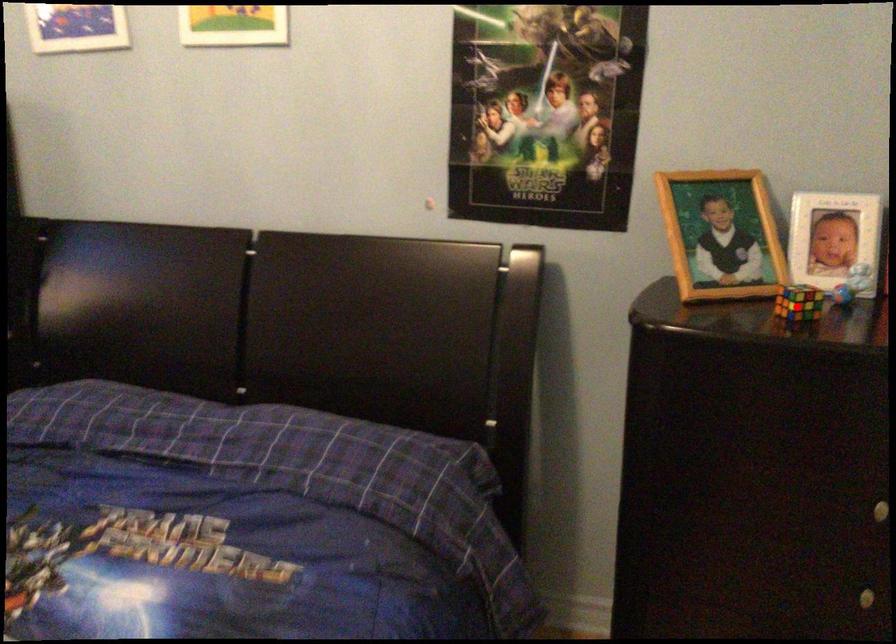
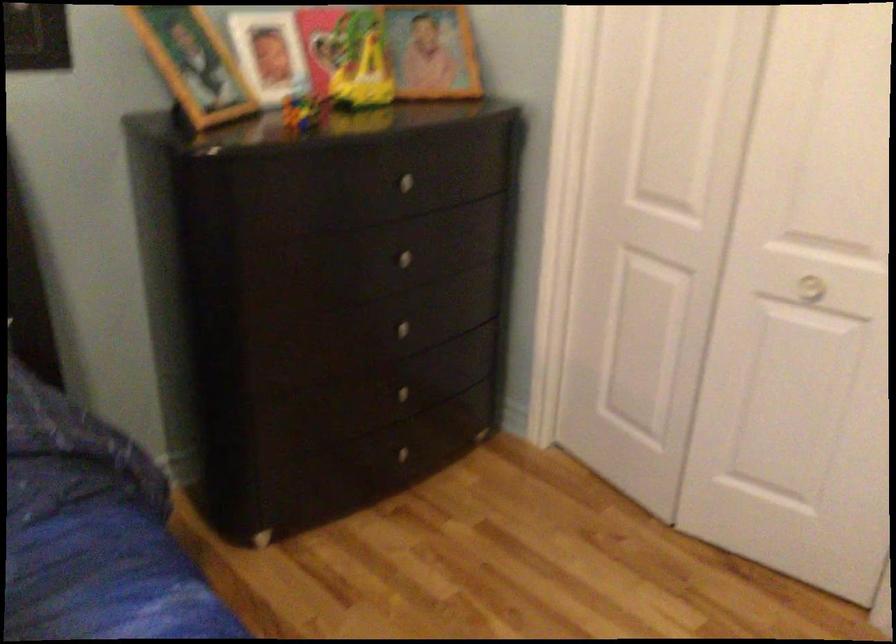
Find the pixel in the second image that matches the highlighted location in the first image.

(303, 111)